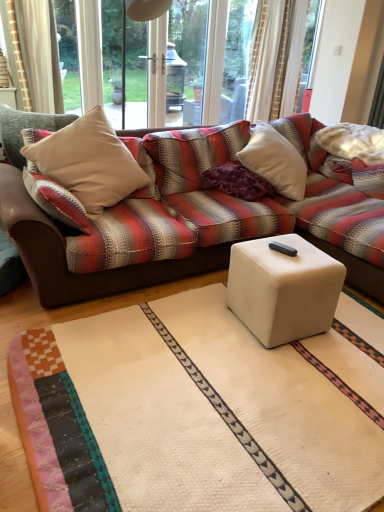
In order to face purple velvet pillow at center, should I rotate leftwards or rightwards?

You should look right and rotate roughly 6.704 degrees.

Describe the element at coordinates (89, 162) in the screenshot. I see `beige fabric pillow at left` at that location.

You are a GUI agent. You are given a task and a screenshot of the screen. Output one action in this format:
    pyautogui.click(x=<x>, y=<y>)
    Task: Click on the transparent glass screen door at upper center
    The height and width of the screenshot is (512, 384).
    Given the screenshot: What is the action you would take?
    pyautogui.click(x=188, y=56)

Is point (199, 72) closer or farther from the camera than point (255, 193)?

Point (199, 72) is positioned farther from the camera compared to point (255, 193).

From their relative heights in the image, would you say transparent glass screen door at upper center is taller or shorter than purple velvet pillow at center?

Clearly, transparent glass screen door at upper center is taller compared to purple velvet pillow at center.

Is transparent glass screen door at upper center facing away from purple velvet pillow at center?

No, transparent glass screen door at upper center's orientation is not away from purple velvet pillow at center.

Which is more to the right, transparent glass screen door at upper center or purple velvet pillow at center?

purple velvet pillow at center is more to the right.

Is white matte cube at center shorter than beige fabric pillow at left?

Yes.

Which of these two, white matte cube at center or beige fabric pillow at left, is smaller?

Smaller between the two is white matte cube at center.

From the image's perspective, does white matte cube at center appear higher than beige fabric pillow at left?

No.

How distant is white matte cube at center from beige fabric pillow at left?

white matte cube at center and beige fabric pillow at left are 3.61 feet apart from each other.

From the image's perspective, is white matte cube at center beneath transparent glass screen door at upper center?

Yes.

From a real-world perspective, is white matte cube at center on top of transparent glass screen door at upper center?

No, from a real-world perspective, white matte cube at center is not over transparent glass screen door at upper center

Considering the relative sizes of white matte cube at center and transparent glass screen door at upper center in the image provided, is white matte cube at center smaller than transparent glass screen door at upper center?

Yes, white matte cube at center is smaller than transparent glass screen door at upper center.

Is point (29, 157) more distant than point (227, 167)?

No, it is in front of (227, 167).

Could you tell me if beige fabric pillow at left is turned towards purple velvet pillow at center?

No, beige fabric pillow at left is not facing towards purple velvet pillow at center.

Is beige fabric pillow at left further to camera compared to purple velvet pillow at center?

No, beige fabric pillow at left is closer to the camera.

Find the location of `pillow located above the beige fabric pillow at left (from the image's perspective)`. pillow located above the beige fabric pillow at left (from the image's perspective) is located at coordinates (238, 182).

Is point (241, 181) closer to camera compared to point (200, 11)?

Yes, point (241, 181) is in front of point (200, 11).

Would you say purple velvet pillow at center is inside or outside transparent glass screen door at upper center?

purple velvet pillow at center is not enclosed by transparent glass screen door at upper center.

Considering the relative sizes of purple velvet pillow at center and transparent glass screen door at upper center in the image provided, is purple velvet pillow at center shorter than transparent glass screen door at upper center?

Yes, purple velvet pillow at center is shorter than transparent glass screen door at upper center.

From the image's perspective, is purple velvet pillow at center on top of transparent glass screen door at upper center?

No, from the image's perspective, purple velvet pillow at center is not above transparent glass screen door at upper center.

Which object is positioned more to the right, purple velvet pillow at center or white matte cube at center?

Positioned to the right is white matte cube at center.

Is purple velvet pillow at center smaller than white matte cube at center?

Indeed, purple velvet pillow at center has a smaller size compared to white matte cube at center.

Could you tell me if purple velvet pillow at center is turned towards white matte cube at center?

No.

At what (x,y) coordinates should I click in order to perform the action: click on coffee table that is under the purple velvet pillow at center (from a real-world perspective). Please return your answer as a coordinate pair (x, y). Looking at the image, I should click on (283, 288).

Which point is more forward, (x=192, y=62) or (x=79, y=154)?

The point (x=79, y=154) is closer.

Considering the relative positions of transparent glass screen door at upper center and beige fabric pillow at left in the image provided, is transparent glass screen door at upper center to the left or to the right of beige fabric pillow at left?

Clearly, transparent glass screen door at upper center is on the right of beige fabric pillow at left in the image.

How much distance is there between transparent glass screen door at upper center and beige fabric pillow at left?

A distance of 2.45 meters exists between transparent glass screen door at upper center and beige fabric pillow at left.

From the image's perspective, which object appears higher, transparent glass screen door at upper center or beige fabric pillow at left?

transparent glass screen door at upper center, from the image's perspective.

The width and height of the screenshot is (384, 512). Identify the location of screen door positioned vertically above the purple velvet pillow at center (from a real-world perspective). point(188,56).

Image resolution: width=384 pixels, height=512 pixels. I want to click on throw pillow above the white matte cube at center (from the image's perspective), so click(x=89, y=162).

Based on the photo, which object lies further to the anchor point white matte cube at center, beige fabric pillow at left or transparent glass screen door at upper center?

Among the two, transparent glass screen door at upper center is located further to white matte cube at center.

Estimate the real-world distances between objects in this image. Which object is further from beige fabric pillow at left, transparent glass screen door at upper center or purple velvet pillow at center?

transparent glass screen door at upper center.

Based on their spatial positions, is transparent glass screen door at upper center or purple velvet pillow at center closer to white matte cube at center?

purple velvet pillow at center is closer to white matte cube at center.

Considering their positions, is white matte cube at center positioned closer to beige fabric pillow at left than transparent glass screen door at upper center?

white matte cube at center is closer to beige fabric pillow at left.

Estimate the real-world distances between objects in this image. Which object is further from purple velvet pillow at center, transparent glass screen door at upper center or white matte cube at center?

transparent glass screen door at upper center lies further to purple velvet pillow at center than the other object.

When comparing their distances from purple velvet pillow at center, does transparent glass screen door at upper center or beige fabric pillow at left seem closer?

beige fabric pillow at left.

Which object lies further to the anchor point white matte cube at center, purple velvet pillow at center or transparent glass screen door at upper center?

The object further to white matte cube at center is transparent glass screen door at upper center.

Looking at the image, which one is located further to transparent glass screen door at upper center, purple velvet pillow at center or white matte cube at center?

The object further to transparent glass screen door at upper center is white matte cube at center.

I want to click on pillow between transparent glass screen door at upper center and white matte cube at center in the vertical direction, so click(x=238, y=182).

You are a GUI agent. You are given a task and a screenshot of the screen. Output one action in this format:
    pyautogui.click(x=<x>, y=<y>)
    Task: Click on the screen door situated between beige fabric pillow at left and purple velvet pillow at center from left to right
    Image resolution: width=384 pixels, height=512 pixels.
    Given the screenshot: What is the action you would take?
    pyautogui.click(x=188, y=56)

The height and width of the screenshot is (512, 384). What are the coordinates of `throw pillow between transparent glass screen door at upper center and white matte cube at center in the vertical direction` in the screenshot? It's located at (89, 162).

Locate an element on the screen. pillow located between beige fabric pillow at left and white matte cube at center in the left-right direction is located at coordinates (238, 182).